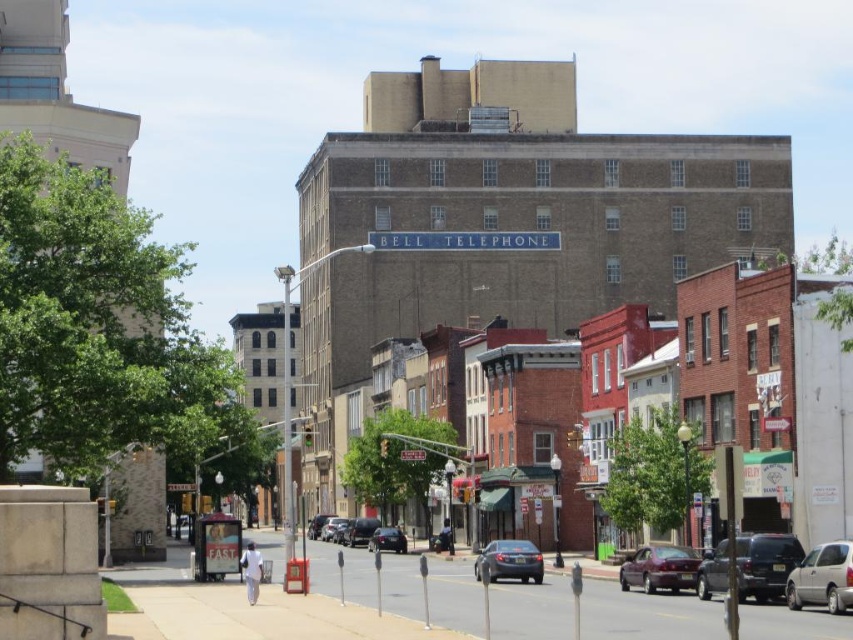
You are a delivery person needing to park your vehicle between the matte black suv at center right and the matte gray sedan at center. Your vehicle is 5 meters long. Is there enough space between them to park?

The distance between the matte black suv at center right and the matte gray sedan at center is 17.31 meters. Since your vehicle is only 5 meters long, there is sufficient space to park between them.

You are a delivery driver who needs to park your matte black car at center in the gray asphalt at center. Can you fit your car in the available space?

The gray asphalt at center is larger in size than matte black car at center, so yes, the matte black car at center can fit in the gray asphalt at center.

You are a delivery person trying to park your silver metallic van at lower right. There is a shiny black sedan at center blocking the parking spot. Can you drive around the sedan to park in the spot?

The silver metallic van at lower right is positioned over the shiny black sedan at center, meaning the van is already parked in the spot, so you cannot drive around the sedan to park there.